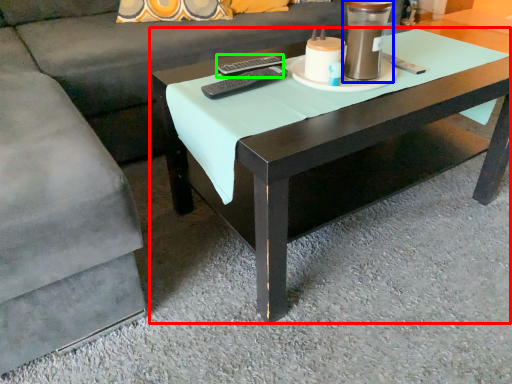
Question: Considering the real-world distances, which object is closest to coffee table (highlighted by a red box)? candle holder (highlighted by a blue box) or remote (highlighted by a green box).

Choices:
 (A) candle holder
 (B) remote

Answer: (A)